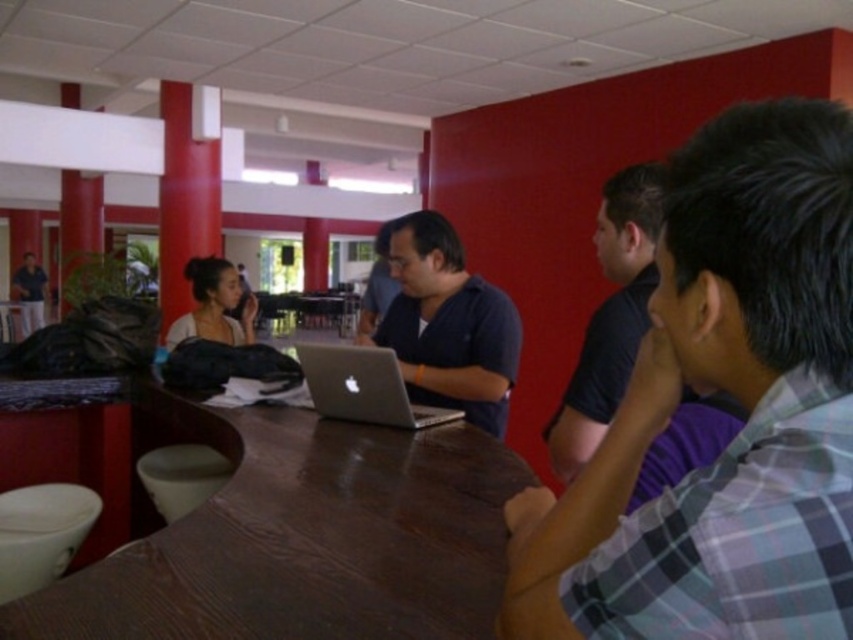
Question: Which point is closer to the camera taking this photo?

Choices:
 (A) (427, 433)
 (B) (440, 298)
 (C) (579, 356)
 (D) (387, 285)

Answer: (C)

Question: From the image, what is the correct spatial relationship of plaid shirt at center in relation to silver metallic laptop at center?

Choices:
 (A) above
 (B) below

Answer: (A)

Question: Where is matte black laptop at center located in relation to matte black shirt at center in the image?

Choices:
 (A) left
 (B) right

Answer: (B)

Question: Can you confirm if purple matte shirt at center is thinner than matte black laptop at center?

Choices:
 (A) no
 (B) yes

Answer: (B)

Question: Which point is closer to the camera?

Choices:
 (A) matte black laptop at left
 (B) plaid shirt at center
 (C) brown wood table at center

Answer: (B)

Question: Which point is farther to the camera?

Choices:
 (A) (30, 288)
 (B) (810, 356)
 (C) (492, 356)

Answer: (A)